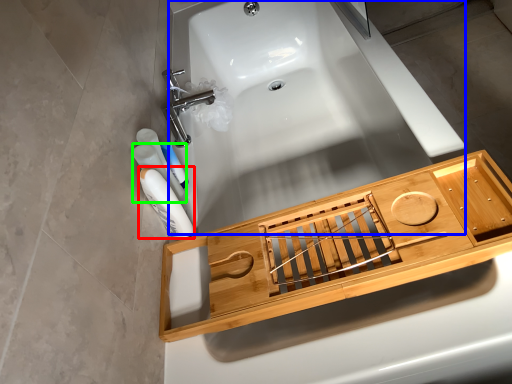
Question: Which object is the closest to the mouthwash (highlighted by a red box)? Choose among these: bath (highlighted by a blue box) or mouthwash (highlighted by a green box).

Choices:
 (A) bath
 (B) mouthwash

Answer: (B)